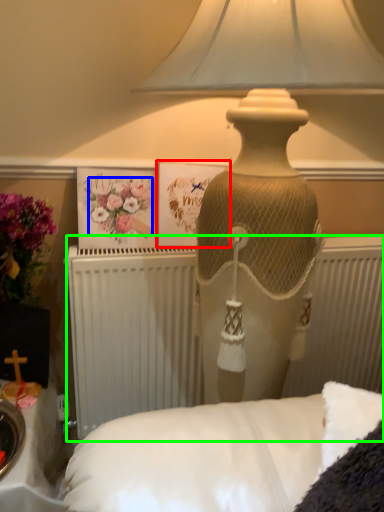
Question: Estimate the real-world distances between objects in this image. Which object is farther from postcard (highlighted by a red box), flower (highlighted by a blue box) or radiator (highlighted by a green box)?

Choices:
 (A) flower
 (B) radiator

Answer: (B)